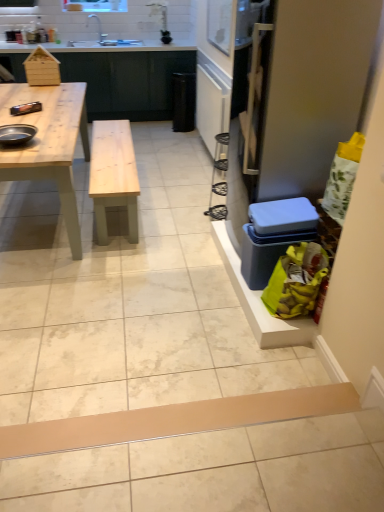
Where is `transparent plastic window screen at upper center`? transparent plastic window screen at upper center is located at coordinates (219, 24).

What do you see at coordinates (16, 134) in the screenshot?
I see `shiny black pan at left` at bounding box center [16, 134].

Locate an element on the screen. This screenshot has height=512, width=384. shiny black pan at left is located at coordinates (16, 134).

Locate an element on the screen. The height and width of the screenshot is (512, 384). natural wood table at left is located at coordinates (49, 143).

Identify the location of clear plastic screen door at right. (304, 93).

Could you tell me if brown cardboard plank at lower center is turned towards matte wood counter at upper left?

No, brown cardboard plank at lower center is not aimed at matte wood counter at upper left.

Considering the points (200, 401) and (147, 110), which point is in front, point (200, 401) or point (147, 110)?

The point (200, 401) is in front.

In terms of width, does brown cardboard plank at lower center look wider or thinner when compared to matte wood counter at upper left?

Considering their sizes, brown cardboard plank at lower center looks slimmer than matte wood counter at upper left.

Choose the correct answer: Is white ceramic sink at upper center inside transparent plastic window screen at upper center or outside it?

white ceramic sink at upper center is located beyond the bounds of transparent plastic window screen at upper center.

Between point (117, 44) and point (224, 40), which one is positioned in front?

Point (224, 40)

From a real-world perspective, is white ceramic sink at upper center positioned above or below transparent plastic window screen at upper center?

white ceramic sink at upper center is below transparent plastic window screen at upper center.

In the scene shown: Between white ceramic sink at upper center and transparent plastic window screen at upper center, which one has less height?

Standing shorter between the two is white ceramic sink at upper center.

Can you confirm if natural wood table at left is thinner than transparent plastic window screen at upper center?

No.

From the image's perspective, is natural wood table at left above transparent plastic window screen at upper center?

Incorrect, from the image's perspective, natural wood table at left is lower than transparent plastic window screen at upper center.

Who is smaller, natural wood table at left or transparent plastic window screen at upper center?

With smaller size is transparent plastic window screen at upper center.

Which is more to the left, white ceramic sink at upper center or clear plastic screen door at right?

white ceramic sink at upper center is more to the left.

Is white ceramic sink at upper center far away from clear plastic screen door at right?

Absolutely, white ceramic sink at upper center is distant from clear plastic screen door at right.

Is white ceramic sink at upper center closer to camera compared to clear plastic screen door at right?

No, it is not.

Which is nearer, [98,41] or [319,15]?

Point [98,41].

Considering the sizes of objects shiny black pan at left and brown cardboard plank at lower center in the image provided, who is bigger, shiny black pan at left or brown cardboard plank at lower center?

brown cardboard plank at lower center.

Does shiny black pan at left lie in front of brown cardboard plank at lower center?

No, it is behind brown cardboard plank at lower center.

Is shiny black pan at left turned away from brown cardboard plank at lower center?

No, shiny black pan at left is not facing away from brown cardboard plank at lower center.

From the image's perspective, which object appears higher, matte wood counter at upper left or brown cardboard plank at lower center?

matte wood counter at upper left is shown above in the image.

From a real-world perspective, is matte wood counter at upper left positioned over brown cardboard plank at lower center based on gravity?

Yes, from a real-world perspective, matte wood counter at upper left is on top of brown cardboard plank at lower center.

Considering the sizes of objects matte wood counter at upper left and brown cardboard plank at lower center in the image provided, who is smaller, matte wood counter at upper left or brown cardboard plank at lower center?

Smaller between the two is brown cardboard plank at lower center.

How many degrees apart are the facing directions of matte wood counter at upper left and brown cardboard plank at lower center?

0.635 degrees.

From a real-world perspective, is clear plastic screen door at right above or below natural wood table at left?

From a real-world perspective, clear plastic screen door at right is physically above natural wood table at left.

Is clear plastic screen door at right touching natural wood table at left?

No, clear plastic screen door at right is not beside natural wood table at left.

Considering the relative sizes of clear plastic screen door at right and natural wood table at left in the image provided, is clear plastic screen door at right bigger than natural wood table at left?

No, clear plastic screen door at right is not bigger than natural wood table at left.

Considering their positions, is clear plastic screen door at right located in front of or behind natural wood table at left?

Clearly, clear plastic screen door at right is in front of natural wood table at left.

At what (x,y) coordinates should I click in order to perform the action: click on counter behind the brown cardboard plank at lower center. Please return your answer as a coordinate pair (x, y). Image resolution: width=384 pixels, height=512 pixels. Looking at the image, I should click on (127, 81).

This screenshot has height=512, width=384. Identify the location of sink located above the transparent plastic window screen at upper center (from the image's perspective). [101, 36].

Which object lies nearer to the anchor point shiny black pan at left, clear plastic screen door at right or brown cardboard plank at lower center?

The object closer to shiny black pan at left is clear plastic screen door at right.

Looking at the image, which one is located further to white ceramic sink at upper center, clear plastic screen door at right or transparent plastic window screen at upper center?

clear plastic screen door at right is further to white ceramic sink at upper center.

Considering their positions, is natural wood table at left positioned further to shiny black pan at left than transparent plastic window screen at upper center?

transparent plastic window screen at upper center.

When comparing their distances from matte wood counter at upper left, does transparent plastic window screen at upper center or white ceramic sink at upper center seem further?

Among the two, transparent plastic window screen at upper center is located further to matte wood counter at upper left.

Based on the photo, when comparing their distances from transparent plastic window screen at upper center, does natural wood table at left or clear plastic screen door at right seem closer?

natural wood table at left is closer to transparent plastic window screen at upper center.

From the image, which object appears to be farther from clear plastic screen door at right, matte wood counter at upper left or transparent plastic window screen at upper center?

Among the two, matte wood counter at upper left is located further to clear plastic screen door at right.

Looking at the image, which one is located closer to transparent plastic window screen at upper center, white ceramic sink at upper center or brown cardboard plank at lower center?

white ceramic sink at upper center.

Considering their positions, is clear plastic screen door at right positioned further to white ceramic sink at upper center than shiny black pan at left?

Among the two, clear plastic screen door at right is located further to white ceramic sink at upper center.

What are the coordinates of `window screen positioned between natural wood table at left and matte wood counter at upper left from near to far` in the screenshot? It's located at (219, 24).

In order to click on window screen located between natural wood table at left and white ceramic sink at upper center in the depth direction in this screenshot , I will do `click(219, 24)`.

Where is `appliance between natural wood table at left and matte wood counter at upper left from front to back`? appliance between natural wood table at left and matte wood counter at upper left from front to back is located at coordinates (16, 134).

Where is `plank located between natural wood table at left and clear plastic screen door at right in the left-right direction`? plank located between natural wood table at left and clear plastic screen door at right in the left-right direction is located at coordinates (175, 420).